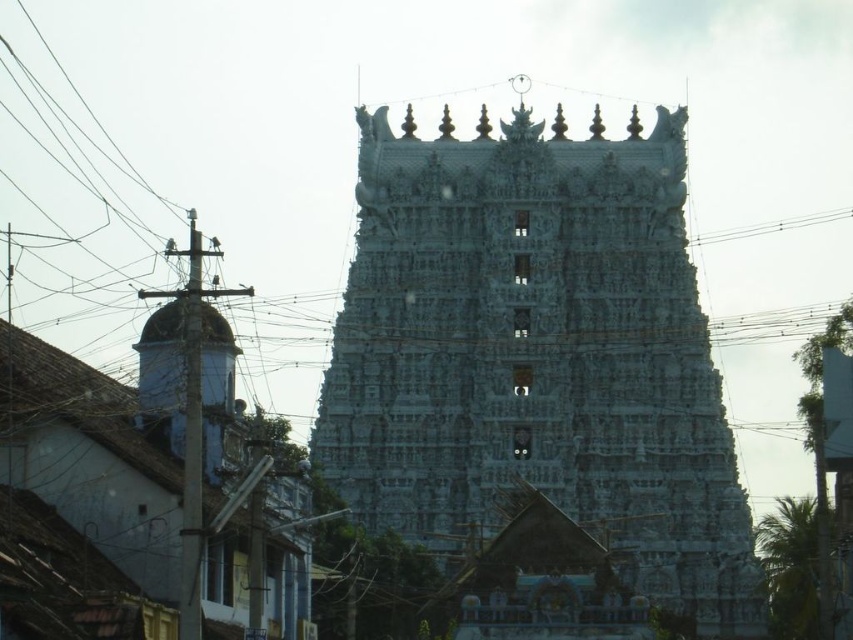
You are a photographer planning to capture the grand temple structure. You notice the white stone temple at center and the black wire at upper center in your frame. Which object should you focus on to ensure the most detailed capture given their sizes?

The white stone temple at center is larger in size than the black wire at upper center, so focusing on the white stone temple at center would allow for a more detailed capture due to its larger size.

You are a photographer planning to capture the white stone temple at center and the black wire at upper center in a single frame. Based on their heights, which object will appear taller in the photo?

The white stone temple at center will appear taller in the photo since it has a greater height compared to the black wire at upper center as stated in the description.